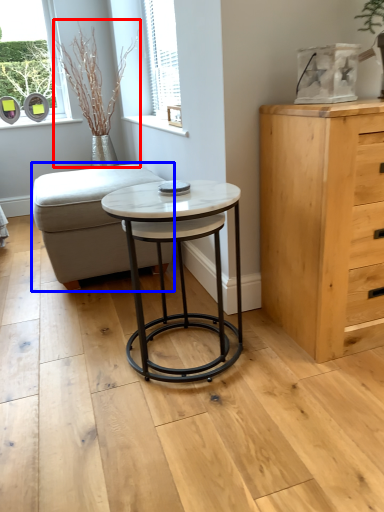
Question: Which of the following is the farthest to the observer, plant (highlighted by a red box) or swivel chair (highlighted by a blue box)?

Choices:
 (A) plant
 (B) swivel chair

Answer: (A)